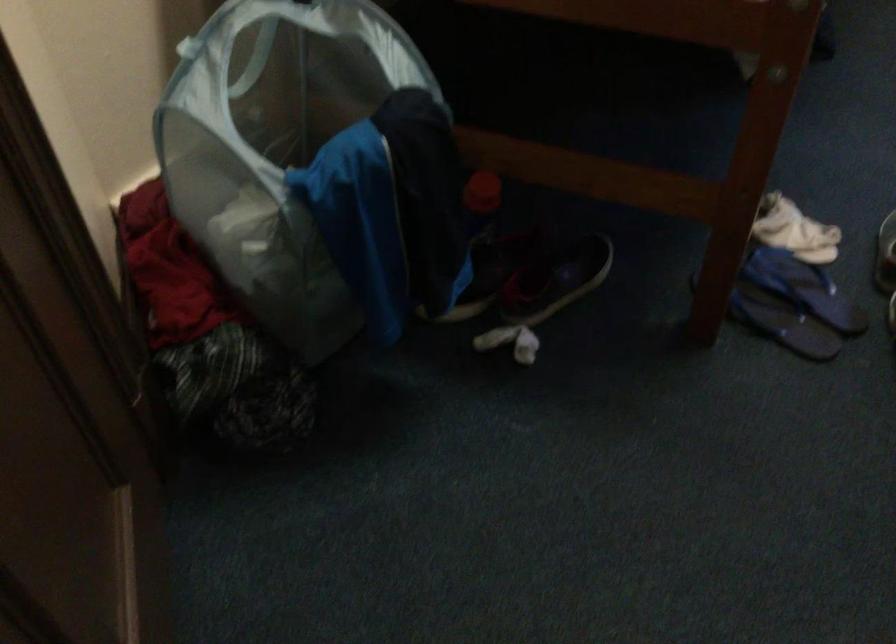
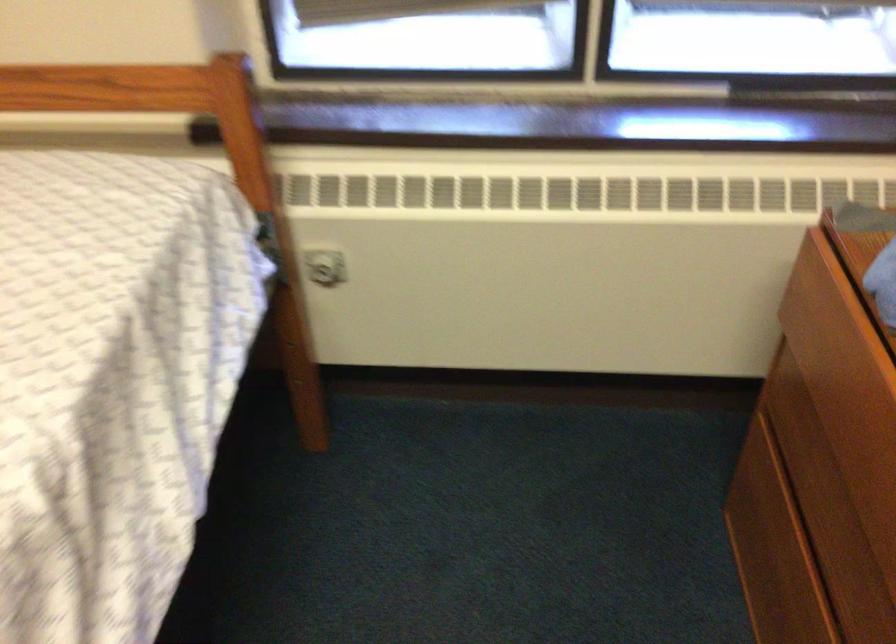
Which direction would the cameraman need to move to produce the second image?

The movement direction of the cameraman is right, forward.